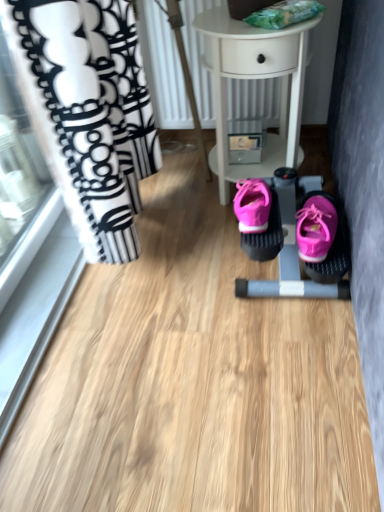
Identify the location of vacant region to the left of pink fabric baby carriage at center. (185, 271).